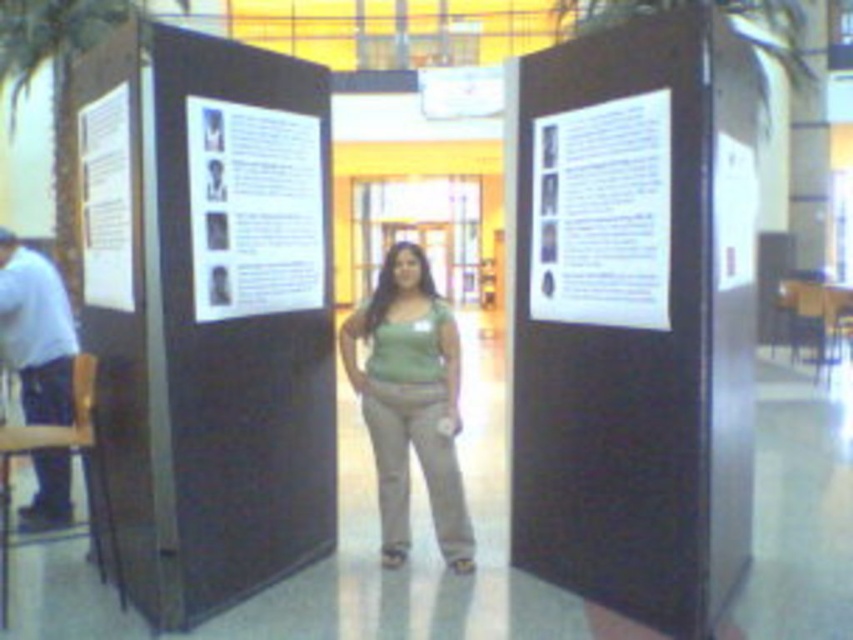
Question: Is white paper at center smaller than brown leather chair at left?

Choices:
 (A) yes
 (B) no

Answer: (A)

Question: Among these points, which one is nearest to the camera?

Choices:
 (A) (45, 508)
 (B) (120, 205)

Answer: (B)

Question: Does white paper at center come in front of green matte tank top at center?

Choices:
 (A) no
 (B) yes

Answer: (B)

Question: Which point is closer to the camera taking this photo?

Choices:
 (A) (83, 436)
 (B) (219, 264)
 (C) (177, 193)
 (D) (643, 420)

Answer: (C)

Question: Is white paper at upper center above white paper at left?

Choices:
 (A) yes
 (B) no

Answer: (B)

Question: Which point appears closest to the camera in this image?

Choices:
 (A) (257, 234)
 (B) (279, 224)

Answer: (A)